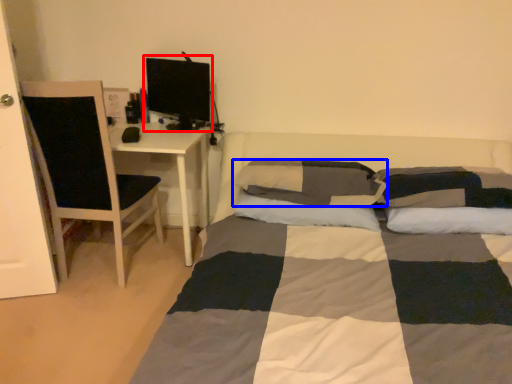
Question: Among these objects, which one is nearest to the camera, computer monitor (highlighted by a red box) or pillow (highlighted by a blue box)?

Choices:
 (A) computer monitor
 (B) pillow

Answer: (B)